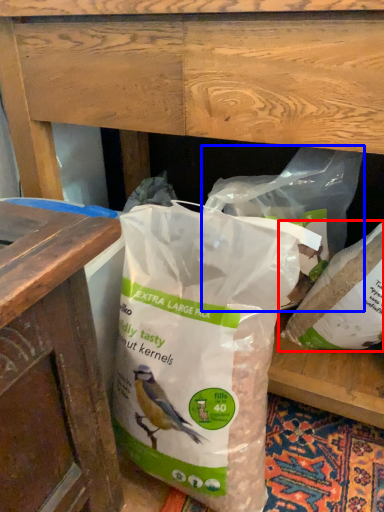
Question: Which object is closer to the camera taking this photo, plastic bag (highlighted by a red box) or plastic bag (highlighted by a blue box)?

Choices:
 (A) plastic bag
 (B) plastic bag

Answer: (B)